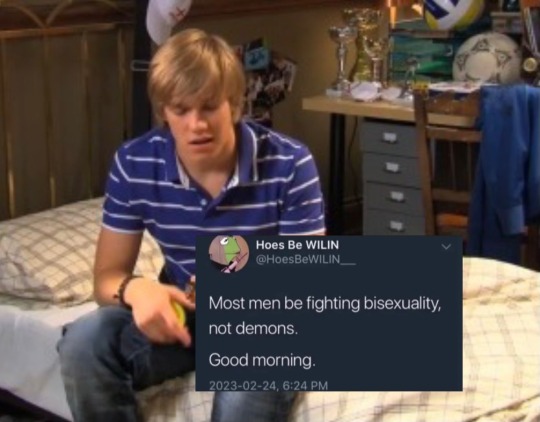
Locate an element on the screen. This screenshot has width=540, height=422. back wall is located at coordinates (269, 30), (319, 40), (35, 177).